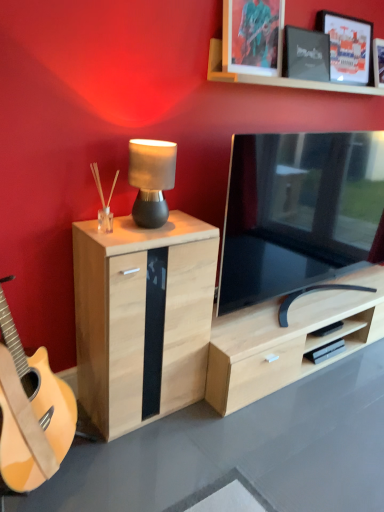
The image size is (384, 512). Find the location of `metallic silver picture frame at upper center, the 1th picture frame viewed from the left`. metallic silver picture frame at upper center, the 1th picture frame viewed from the left is located at coordinates (253, 36).

What do you see at coordinates (306, 54) in the screenshot? The width and height of the screenshot is (384, 512). I see `black matte picture frame at upper right, which is the second picture frame from left to right` at bounding box center [306, 54].

Find the location of a particular element. The width and height of the screenshot is (384, 512). matte black lamp at center is located at coordinates tap(151, 179).

Is metallic silver picture frame at upper center, the 1th picture frame viewed from the left, touching black glossy tv at center?

metallic silver picture frame at upper center, the 1th picture frame viewed from the left, and black glossy tv at center are not in contact.

From the picture: Considering the relative sizes of metallic silver picture frame at upper center, the 1th picture frame viewed from the left, and black glossy tv at center in the image provided, is metallic silver picture frame at upper center, the 1th picture frame viewed from the left, bigger than black glossy tv at center?

No, metallic silver picture frame at upper center, the 1th picture frame viewed from the left, is not bigger than black glossy tv at center.

Is metallic silver picture frame at upper center, which is counted as the 3th picture frame, starting from the right, completely or partially outside of black glossy tv at center?

That's correct, metallic silver picture frame at upper center, which is counted as the 3th picture frame, starting from the right, is outside of black glossy tv at center.

Which is in front, point (262, 5) or point (283, 164)?

The point (262, 5) is closer to the camera.

In the scene shown: Considering the sizes of objects black glossy tv at center and natural wood cabinet at left in the image provided, who is shorter, black glossy tv at center or natural wood cabinet at left?

Standing shorter between the two is natural wood cabinet at left.

Based on the photo, does black glossy tv at center have a greater width compared to natural wood cabinet at left?

In fact, black glossy tv at center might be narrower than natural wood cabinet at left.

Consider the image. Which object is positioned more to the left, black glossy tv at center or natural wood cabinet at left?

From the viewer's perspective, natural wood cabinet at left appears more on the left side.

Does wooden frame at upper center have a smaller size compared to black glossy tv at center?

Correct, wooden frame at upper center occupies less space than black glossy tv at center.

Is wooden frame at upper center wider than black glossy tv at center?

Yes.

Between wooden frame at upper center and black glossy tv at center, which one has more height?

black glossy tv at center.

Considering the sizes of objects metallic silver picture frame at upper center, which is counted as the 3th picture frame, starting from the right, and matte black picture frame at upper right, the 3th picture frame when ordered from left to right, in the image provided, who is shorter, metallic silver picture frame at upper center, which is counted as the 3th picture frame, starting from the right, or matte black picture frame at upper right, the 3th picture frame when ordered from left to right,?

metallic silver picture frame at upper center, which is counted as the 3th picture frame, starting from the right, is shorter.

Which object is closer to the camera, metallic silver picture frame at upper center, the 1th picture frame viewed from the left, or matte black picture frame at upper right, the first picture frame from the right?

Positioned in front is metallic silver picture frame at upper center, the 1th picture frame viewed from the left.

The image size is (384, 512). In order to click on the 2nd picture frame in front when counting from the matte black picture frame at upper right, the first picture frame from the right in this screenshot , I will do `click(253, 36)`.

From the image's perspective, is metallic silver picture frame at upper center, the 1th picture frame viewed from the left, on top of matte black picture frame at upper right, the first picture frame from the right?

No, from the image's perspective, metallic silver picture frame at upper center, the 1th picture frame viewed from the left, is not above matte black picture frame at upper right, the first picture frame from the right.

Which is in front, black matte picture frame at upper right, the 2th picture frame viewed from the right, or black glossy tv at center?

black glossy tv at center is more forward.

From a real-world perspective, is black matte picture frame at upper right, which is the second picture frame from left to right, on top of black glossy tv at center?

Correct, in the physical world, black matte picture frame at upper right, which is the second picture frame from left to right, is higher than black glossy tv at center.

Looking at their sizes, would you say black matte picture frame at upper right, the 2th picture frame viewed from the right, is wider or thinner than black glossy tv at center?

black matte picture frame at upper right, the 2th picture frame viewed from the right, is thinner than black glossy tv at center.

Would you say black matte picture frame at upper right, the 2th picture frame viewed from the right, is to the left or to the right of black glossy tv at center in the picture?

black matte picture frame at upper right, the 2th picture frame viewed from the right, is positioned on black glossy tv at center's left side.

Could you tell me if matte black picture frame at upper right, the 3th picture frame when ordered from left to right, is facing black matte picture frame at upper right, the 2th picture frame viewed from the right?

No, matte black picture frame at upper right, the 3th picture frame when ordered from left to right, is not aimed at black matte picture frame at upper right, the 2th picture frame viewed from the right.

In the scene shown: From a real-world perspective, is matte black picture frame at upper right, the 3th picture frame when ordered from left to right, over black matte picture frame at upper right, which is the second picture frame from left to right?

Indeed, from a real-world perspective, matte black picture frame at upper right, the 3th picture frame when ordered from left to right, stands above black matte picture frame at upper right, which is the second picture frame from left to right.

Based on their sizes in the image, would you say matte black picture frame at upper right, the first picture frame from the right, is bigger or smaller than black matte picture frame at upper right, which is the second picture frame from left to right?

In the image, matte black picture frame at upper right, the first picture frame from the right, appears to be larger than black matte picture frame at upper right, which is the second picture frame from left to right.

Which is more to the left, matte black picture frame at upper right, the 3th picture frame when ordered from left to right, or black matte picture frame at upper right, the 2th picture frame viewed from the right?

Positioned to the left is black matte picture frame at upper right, the 2th picture frame viewed from the right.

Relative to black glossy tv at center, is matte black picture frame at upper right, the first picture frame from the right, in front or behind?

matte black picture frame at upper right, the first picture frame from the right, is behind black glossy tv at center.

Looking at their sizes, would you say matte black picture frame at upper right, the first picture frame from the right, is wider or thinner than black glossy tv at center?

Clearly, matte black picture frame at upper right, the first picture frame from the right, has less width compared to black glossy tv at center.

Is matte black picture frame at upper right, the first picture frame from the right, positioned with its back to black glossy tv at center?

matte black picture frame at upper right, the first picture frame from the right, is not turned away from black glossy tv at center.

Find the location of a particular element. This screenshot has width=384, height=512. television in front of the matte black picture frame at upper right, the 3th picture frame when ordered from left to right is located at coordinates (295, 213).

This screenshot has height=512, width=384. I want to click on television that appears in front of the metallic silver picture frame at upper center, which is counted as the 3th picture frame, starting from the right, so click(x=295, y=213).

You are a GUI agent. You are given a task and a screenshot of the screen. Output one action in this format:
    pyautogui.click(x=<x>, y=<y>)
    Task: Click on the television behind the natural wood cabinet at left
    The height and width of the screenshot is (512, 384).
    Given the screenshot: What is the action you would take?
    pyautogui.click(x=295, y=213)

From the image, which object appears to be farther from black matte picture frame at upper right, which is the second picture frame from left to right, matte black lamp at center or wooden frame at upper center?

matte black lamp at center is positioned further to the anchor black matte picture frame at upper right, which is the second picture frame from left to right.

Which object lies further to the anchor point matte black lamp at center, metallic silver picture frame at upper center, which is counted as the 3th picture frame, starting from the right, or black matte picture frame at upper right, the 2th picture frame viewed from the right?

black matte picture frame at upper right, the 2th picture frame viewed from the right, is further to matte black lamp at center.

When comparing their distances from black glossy tv at center, does black matte picture frame at upper right, the 2th picture frame viewed from the right, or matte black lamp at center seem closer?

black matte picture frame at upper right, the 2th picture frame viewed from the right, lies closer to black glossy tv at center than the other object.

Based on their spatial positions, is matte black picture frame at upper right, the first picture frame from the right, or wooden frame at upper center closer to matte black lamp at center?

The object closer to matte black lamp at center is wooden frame at upper center.

Which object lies nearer to the anchor point metallic silver picture frame at upper center, which is counted as the 3th picture frame, starting from the right, natural wood cabinet at left or wooden frame at upper center?

wooden frame at upper center lies closer to metallic silver picture frame at upper center, which is counted as the 3th picture frame, starting from the right, than the other object.

From the image, which object appears to be farther from metallic silver picture frame at upper center, which is counted as the 3th picture frame, starting from the right, black matte picture frame at upper right, which is the second picture frame from left to right, or natural wood cabinet at left?

natural wood cabinet at left is further to metallic silver picture frame at upper center, which is counted as the 3th picture frame, starting from the right.

Looking at the image, which one is located closer to matte black lamp at center, black matte picture frame at upper right, the 2th picture frame viewed from the right, or black glossy tv at center?

The object closer to matte black lamp at center is black glossy tv at center.

Estimate the real-world distances between objects in this image. Which object is closer to matte black lamp at center, black matte picture frame at upper right, the 2th picture frame viewed from the right, or natural wood cabinet at left?

natural wood cabinet at left lies closer to matte black lamp at center than the other object.

The image size is (384, 512). I want to click on television that lies between black matte picture frame at upper right, which is the second picture frame from left to right, and natural wood cabinet at left from top to bottom, so click(295, 213).

Find the location of a particular element. shelf located between matte black lamp at center and matte black picture frame at upper right, the 3th picture frame when ordered from left to right, in the left-right direction is located at coordinates pyautogui.click(x=277, y=77).

Identify the location of table lamp between black matte picture frame at upper right, the 2th picture frame viewed from the right, and natural wood cabinet at left vertically. (151, 179).

Identify the location of shelf between matte black lamp at center and black glossy tv at center. (277, 77).